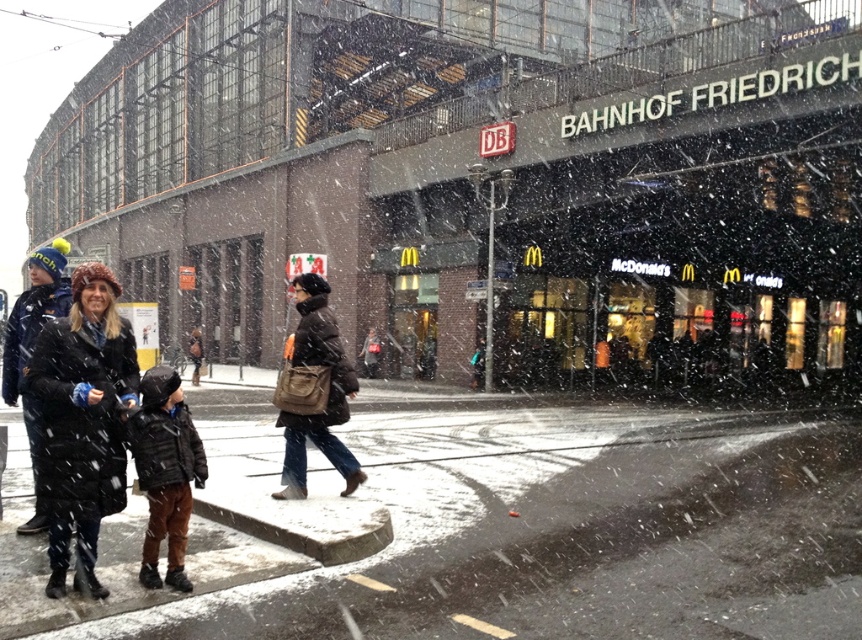
You are a delivery person trying to walk from the sidewalk to the train station entrance. The smooth concrete sidewalk at center is in front of the dark brown leather jacket at lower left. Which object should you avoid stepping on to reach the entrance?

You should avoid stepping on the dark brown leather jacket at lower left because it is behind the smooth concrete sidewalk at center, so stepping on the jacket would require moving past the sidewalk first.

You are a delivery person trying to navigate through the snow at Bahnhof Friedrich station. You need to place a large package on the smooth concrete sidewalk at center without blocking the dark brown leather jacket at lower left. Is the sidewalk big enough to accommodate the package?

The smooth concrete sidewalk at center is bigger than the dark brown leather jacket at lower left, so yes, the sidewalk is large enough to place the package without blocking the jacket.